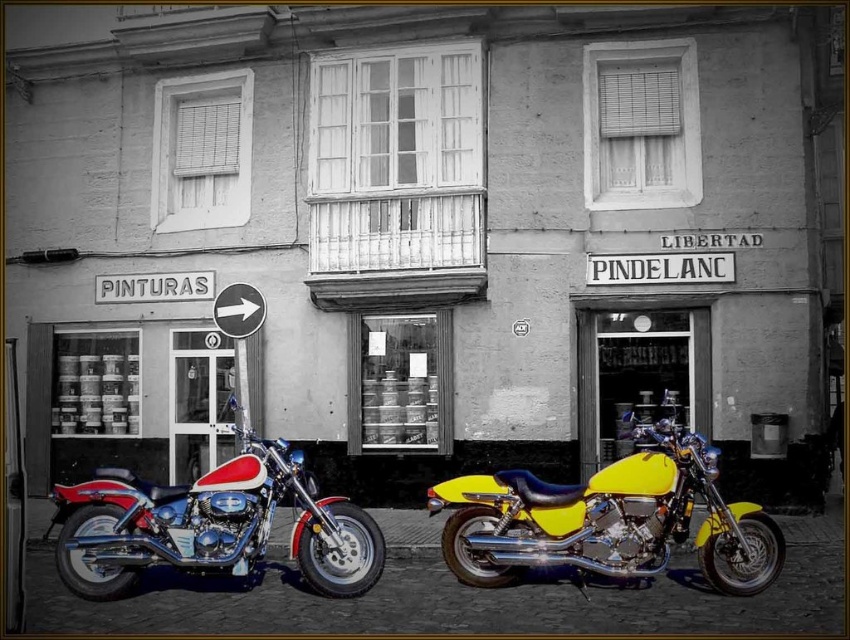
Question: Considering the relative positions of yellow shiny motorcycle at center and shiny chrome motorcycle at center in the image provided, where is yellow shiny motorcycle at center located with respect to shiny chrome motorcycle at center?

Choices:
 (A) below
 (B) above

Answer: (B)

Question: Among these objects, which one is nearest to the camera?

Choices:
 (A) yellow shiny motorcycle at center
 (B) shiny chrome motorcycle at center

Answer: (A)

Question: Which of the following is the closest to the observer?

Choices:
 (A) (129, 580)
 (B) (666, 506)

Answer: (A)

Question: Is yellow shiny motorcycle at center below shiny chrome motorcycle at center?

Choices:
 (A) no
 (B) yes

Answer: (A)

Question: Among these objects, which one is farthest from the camera?

Choices:
 (A) shiny chrome motorcycle at center
 (B) yellow shiny motorcycle at center

Answer: (A)

Question: Does yellow shiny motorcycle at center have a lesser width compared to shiny chrome motorcycle at center?

Choices:
 (A) no
 (B) yes

Answer: (A)